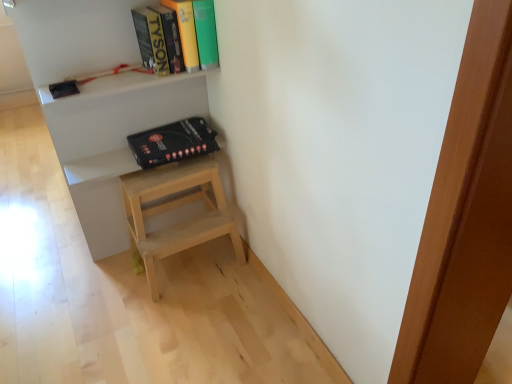
Identify the location of vacant area on top of hardcover book at upper center (from a real-world perspective). (165, 0).